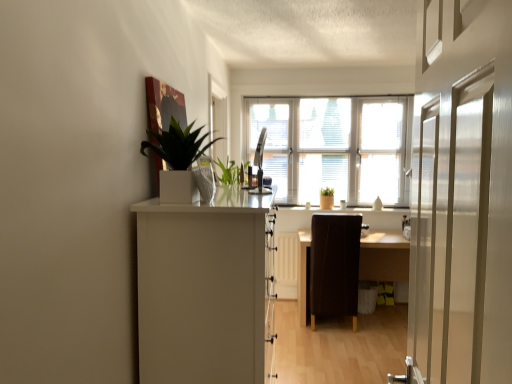
Question: Is point (172, 125) closer or farther from the camera than point (365, 248)?

Choices:
 (A) closer
 (B) farther

Answer: (A)

Question: Based on their sizes in the image, would you say green matte plant at upper left is bigger or smaller than wooden table at center?

Choices:
 (A) big
 (B) small

Answer: (B)

Question: Which object is the closest to the white glossy window at center?

Choices:
 (A) white matte cabinet at left
 (B) brown leather chair at center
 (C) metallic silver monitor at center
 (D) wooden table at center
 (E) green matte plant at upper left

Answer: (C)

Question: Which is nearer to the brown leather chair at center?

Choices:
 (A) metallic silver monitor at center
 (B) white glossy door at right
 (C) green matte plant at upper left
 (D) white glossy window at center
 (E) wooden table at center

Answer: (E)